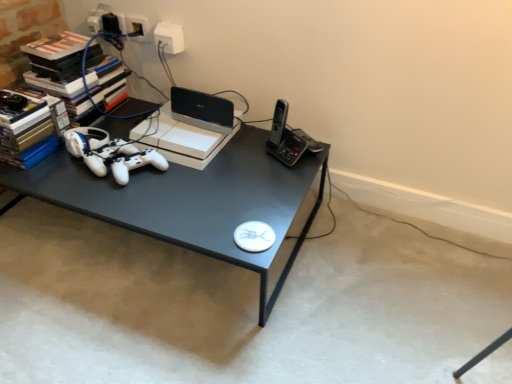
You are a GUI agent. You are given a task and a screenshot of the screen. Output one action in this format:
    pyautogui.click(x=<x>, y=<y>)
    Task: Click on the matte black desk at center
    
    Given the screenshot: What is the action you would take?
    pyautogui.click(x=191, y=200)

In order to face white matte game controller at center, should I rotate leftwards or rightwards?

Turn left approximately 15.703 degrees to face it.

This screenshot has width=512, height=384. Describe the element at coordinates (169, 37) in the screenshot. I see `white plastic outlet at upper center` at that location.

This screenshot has width=512, height=384. What are the coordinates of `black plastic router at upper center` in the screenshot? It's located at (202, 110).

Is white plastic outlet at upper center positioned with its back to matte black desk at center?

That's not correct — white plastic outlet at upper center is not looking away from matte black desk at center.

In the scene shown: Which of these two, white plastic outlet at upper center or matte black desk at center, stands taller?

With more height is matte black desk at center.

Does white plastic outlet at upper center appear on the left side of matte black desk at center?

No, white plastic outlet at upper center is not to the left of matte black desk at center.

Identify the location of electric outlet lying behind the matte black desk at center. The height and width of the screenshot is (384, 512). (169, 37).

From a real-world perspective, which object stands above the other?

From a 3D spatial view, black plastic router at upper center is above.

Looking at this image, is matte black desk at center aimed at black plastic router at upper center?

No, matte black desk at center is not turned towards black plastic router at upper center.

Is matte black desk at center taller than black plastic router at upper center?

Indeed, matte black desk at center has a greater height compared to black plastic router at upper center.

Is the surface of matte black desk at center in direct contact with black plastic router at upper center?

No, matte black desk at center is not next to black plastic router at upper center.

Who is more distant, matte black desk at center or white plastic outlet at upper center?

Positioned behind is white plastic outlet at upper center.

Based on the photo, which object is wider, matte black desk at center or white plastic outlet at upper center?

matte black desk at center is wider.

Between matte black desk at center and white plastic outlet at upper center, which one appears on the left side from the viewer's perspective?

Positioned to the left is matte black desk at center.

Is white plastic outlet at upper center located within matte black desk at center?

No, white plastic outlet at upper center is not inside matte black desk at center.

From a real-world perspective, is white matte game controller at center below black plastic router at upper center?

Yes, from a real-world perspective, white matte game controller at center is below black plastic router at upper center.

Is point (123, 170) farther from camera compared to point (204, 127)?

No, (123, 170) is closer to viewer.

From the image's perspective, does white matte game controller at center appear higher than black plastic router at upper center?

No, from the image's perspective, white matte game controller at center is not above black plastic router at upper center.

You are a GUI agent. You are given a task and a screenshot of the screen. Output one action in this format:
    pyautogui.click(x=<x>, y=<y>)
    Task: Click on the laptop on the right of matte black desk at center
    The image size is (512, 384).
    Given the screenshot: What is the action you would take?
    pyautogui.click(x=202, y=110)

Based on their positions, is black plastic router at upper center located to the left or right of matte black desk at center?

Clearly, black plastic router at upper center is on the right of matte black desk at center in the image.

Which is correct: black plastic router at upper center is inside matte black desk at center, or outside of it?

black plastic router at upper center lies outside matte black desk at center.

From the image's perspective, is white plastic outlet at upper center positioned above or below black plastic router at upper center?

Based on their image positions, white plastic outlet at upper center is located above black plastic router at upper center.

This screenshot has height=384, width=512. What are the coordinates of `electric outlet that is behind the black plastic router at upper center` in the screenshot? It's located at (169, 37).

Which object is further away from the camera, white plastic outlet at upper center or black plastic router at upper center?

white plastic outlet at upper center is further away from the camera.

Does white plastic outlet at upper center contain black plastic router at upper center?

No, black plastic router at upper center is located outside of white plastic outlet at upper center.

From a real-world perspective, which object rests below the other?

In real-world perspective, white matte game controller at center is lower.

From the picture: Is black plastic router at upper center facing towards white matte game controller at center?

Yes.

Locate an element on the screen. Image resolution: width=512 pixels, height=384 pixels. laptop on the right of white matte game controller at center is located at coordinates (202, 110).

From the image's perspective, is black plastic router at upper center located above or below white matte game controller at center?

Based on their image positions, black plastic router at upper center is located above white matte game controller at center.

The width and height of the screenshot is (512, 384). In order to click on desk located in front of the white plastic outlet at upper center in this screenshot , I will do `click(191, 200)`.

You are a GUI agent. You are given a task and a screenshot of the screen. Output one action in this format:
    pyautogui.click(x=<x>, y=<y>)
    Task: Click on the desk to the left of black plastic router at upper center
    
    Given the screenshot: What is the action you would take?
    pyautogui.click(x=191, y=200)

Which object lies nearer to the anchor point white matte game controller at center, matte black desk at center or black plastic router at upper center?

matte black desk at center lies closer to white matte game controller at center than the other object.

Based on their spatial positions, is matte black desk at center or white matte game controller at center closer to black plastic router at upper center?

white matte game controller at center.

Which object lies further to the anchor point matte black desk at center, white matte game controller at center or black plastic router at upper center?

black plastic router at upper center lies further to matte black desk at center than the other object.

When comparing their distances from black plastic router at upper center, does white matte game controller at center or matte black desk at center seem further?

Among the two, matte black desk at center is located further to black plastic router at upper center.

Estimate the real-world distances between objects in this image. Which object is closer to matte black desk at center, black plastic router at upper center or white plastic outlet at upper center?

The object closer to matte black desk at center is black plastic router at upper center.

When comparing their distances from matte black desk at center, does black plastic router at upper center or white matte game controller at center seem further?

black plastic router at upper center lies further to matte black desk at center than the other object.

When comparing their distances from black plastic router at upper center, does white plastic outlet at upper center or matte black desk at center seem further?

Based on the image, matte black desk at center appears to be further to black plastic router at upper center.

Considering their positions, is white plastic outlet at upper center positioned further to black plastic router at upper center than white matte game controller at center?

white plastic outlet at upper center lies further to black plastic router at upper center than the other object.

The height and width of the screenshot is (384, 512). What are the coordinates of `game controller located between matte black desk at center and black plastic router at upper center in the depth direction` in the screenshot? It's located at pyautogui.click(x=110, y=153).

Where is `laptop that lies between white plastic outlet at upper center and matte black desk at center from top to bottom`? Image resolution: width=512 pixels, height=384 pixels. laptop that lies between white plastic outlet at upper center and matte black desk at center from top to bottom is located at coordinates (202, 110).

The image size is (512, 384). In order to click on laptop between white plastic outlet at upper center and white matte game controller at center in the vertical direction in this screenshot , I will do `click(202, 110)`.

This screenshot has height=384, width=512. I want to click on game controller between white plastic outlet at upper center and matte black desk at center vertically, so click(x=110, y=153).